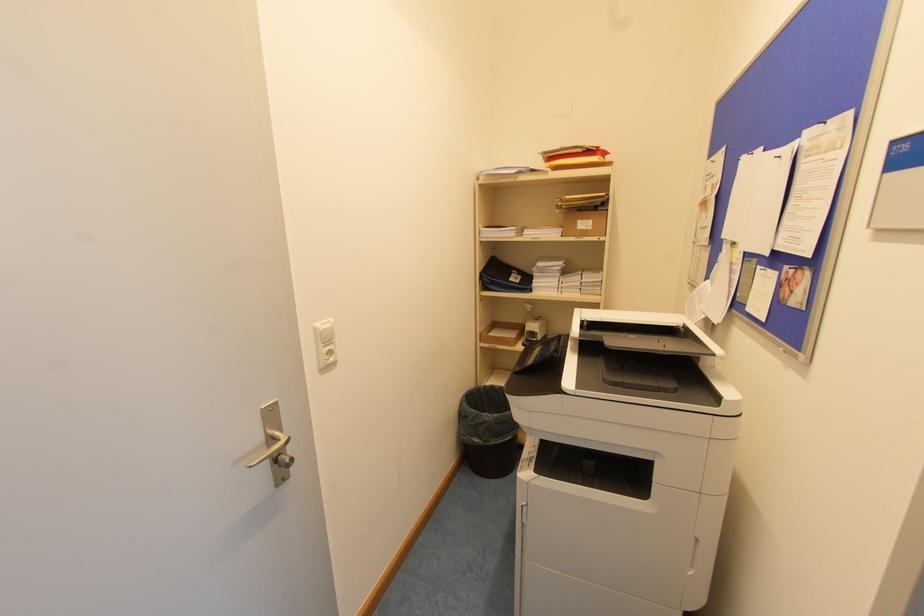
What do you see at coordinates (324, 344) in the screenshot? I see `the white light switch` at bounding box center [324, 344].